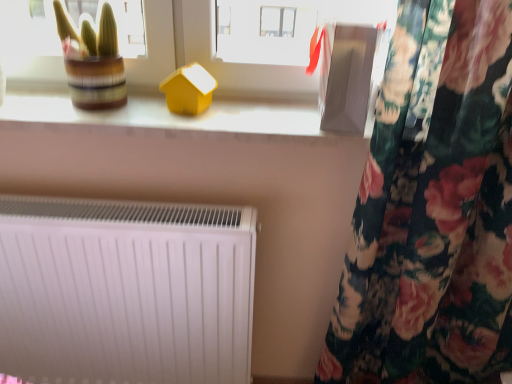
Find the location of a particular element. This screenshot has width=512, height=384. matte yellow house at upper center is located at coordinates (168, 114).

Measure the distance between white matte radiator at lower left and camera.

A distance of 98.73 centimeters exists between white matte radiator at lower left and camera.

Image resolution: width=512 pixels, height=384 pixels. What do you see at coordinates (92, 60) in the screenshot?
I see `green striped pot at upper left` at bounding box center [92, 60].

Measure the distance between point (105, 15) and camera.

The depth of point (105, 15) is 3.37 feet.

What is the approximate width of white plastic house at upper center?

2.59 inches.

The width and height of the screenshot is (512, 384). What are the coordinates of `matte yellow house at center` in the screenshot? It's located at (188, 90).

At what (x,y) coordinates should I click in order to perform the action: click on window above the matte yellow house at upper center (from the image's perspective). Please return your answer as a coordinate pair (x, y). This screenshot has width=512, height=384. Looking at the image, I should click on (254, 52).

Is white plastic house at upper center facing towards matte yellow house at upper center?

No, white plastic house at upper center does not turn towards matte yellow house at upper center.

Who is smaller, white plastic house at upper center or matte yellow house at upper center?

With smaller size is matte yellow house at upper center.

Which is more to the right, white plastic house at upper center or matte yellow house at upper center?

white plastic house at upper center.

Which object is wider, matte yellow house at upper center or green striped pot at upper left?

matte yellow house at upper center.

Is the position of matte yellow house at upper center less distant than that of green striped pot at upper left?

That is False.

From a real-world perspective, is matte yellow house at upper center over green striped pot at upper left?

No, from a real-world perspective, matte yellow house at upper center is not on top of green striped pot at upper left.

Does matte yellow house at upper center contain green striped pot at upper left?

Definitely not — green striped pot at upper left is not inside matte yellow house at upper center.

Does green striped pot at upper left have a lesser width compared to matte yellow house at center?

Incorrect, the width of green striped pot at upper left is not less than that of matte yellow house at center.

Is green striped pot at upper left next to matte yellow house at center?

No, green striped pot at upper left is not in contact with matte yellow house at center.

Based on the photo, measure the distance from green striped pot at upper left to matte yellow house at center.

The distance of green striped pot at upper left from matte yellow house at center is 18.67 centimeters.

Looking at their sizes, would you say white matte radiator at lower left is wider or thinner than green striped pot at upper left?

Considering their sizes, white matte radiator at lower left looks slimmer than green striped pot at upper left.

Would you say green striped pot at upper left is part of white matte radiator at lower left's contents?

No, green striped pot at upper left is located outside of white matte radiator at lower left.

Does white matte radiator at lower left lie in front of green striped pot at upper left?

That is False.

Is point (220, 350) closer or farther from the camera than point (71, 40)?

Point (220, 350) is farther from the camera than point (71, 40).

From the image's perspective, is white plastic house at upper center above or below matte yellow house at center?

From the image's perspective, white plastic house at upper center appears above matte yellow house at center.

Is white plastic house at upper center with matte yellow house at center?

No.

Visually, is white plastic house at upper center positioned to the left or to the right of matte yellow house at center?

Based on their positions, white plastic house at upper center is located to the right of matte yellow house at center.

Is white plastic house at upper center oriented towards matte yellow house at center?

Yes.

From their relative heights in the image, would you say green striped pot at upper left is taller or shorter than matte yellow house at upper center?

Clearly, green striped pot at upper left is taller compared to matte yellow house at upper center.

From the image's perspective, is green striped pot at upper left located above or below matte yellow house at upper center?

Clearly, from the image's perspective, green striped pot at upper left is above matte yellow house at upper center.

Considering the sizes of green striped pot at upper left and matte yellow house at upper center in the image, is green striped pot at upper left wider or thinner than matte yellow house at upper center?

In the image, green striped pot at upper left appears to be more narrow than matte yellow house at upper center.

Is green striped pot at upper left facing towards matte yellow house at upper center?

No, green striped pot at upper left does not turn towards matte yellow house at upper center.

Would you say white matte radiator at lower left is inside or outside white plastic house at upper center?

white matte radiator at lower left exists outside the volume of white plastic house at upper center.

Is point (8, 347) positioned in front of point (27, 30)?

That is True.

Would you say white matte radiator at lower left is to the left or to the right of white plastic house at upper center in the picture?

In the image, white matte radiator at lower left appears on the left side of white plastic house at upper center.

Considering the sizes of objects white matte radiator at lower left and white plastic house at upper center in the image provided, who is shorter, white matte radiator at lower left or white plastic house at upper center?

white plastic house at upper center.

Find the location of a particular element. Image resolution: width=512 pixels, height=384 pixels. window that appears above the matte yellow house at upper center (from a real-world perspective) is located at coordinates pos(254,52).

The width and height of the screenshot is (512, 384). In the image, there is a green striped pot at upper left. Identify the location of window sill below it (from the image's perspective). (168, 114).

Considering their positions, is matte yellow house at center positioned further to white matte radiator at lower left than white plastic house at upper center?

matte yellow house at center.

Estimate the real-world distances between objects in this image. Which object is further from matte yellow house at center, green striped pot at upper left or white matte radiator at lower left?

Based on the image, white matte radiator at lower left appears to be further to matte yellow house at center.

Considering their positions, is white matte radiator at lower left positioned closer to matte yellow house at center than green striped pot at upper left?

green striped pot at upper left is closer to matte yellow house at center.

Which object lies nearer to the anchor point white matte radiator at lower left, green striped pot at upper left or matte yellow house at upper center?

matte yellow house at upper center is positioned closer to the anchor white matte radiator at lower left.

Estimate the real-world distances between objects in this image. Which object is further from matte yellow house at center, matte yellow house at upper center or white plastic house at upper center?

Based on the image, white plastic house at upper center appears to be further to matte yellow house at center.

Looking at the image, which one is located further to green striped pot at upper left, matte yellow house at upper center or white matte radiator at lower left?

white matte radiator at lower left is positioned further to the anchor green striped pot at upper left.

From the image, which object appears to be nearer to matte yellow house at upper center, matte yellow house at center or white matte radiator at lower left?

The object closer to matte yellow house at upper center is matte yellow house at center.

When comparing their distances from green striped pot at upper left, does matte yellow house at center or matte yellow house at upper center seem closer?

Based on the image, matte yellow house at upper center appears to be nearer to green striped pot at upper left.

Image resolution: width=512 pixels, height=384 pixels. Find the location of `window sill between green striped pot at upper left and white plastic house at upper center from left to right`. window sill between green striped pot at upper left and white plastic house at upper center from left to right is located at coordinates (168, 114).

Identify the location of toy situated between green striped pot at upper left and matte yellow house at upper center from left to right. (188, 90).

Locate an element on the screen. The height and width of the screenshot is (384, 512). window sill between matte yellow house at center and white matte radiator at lower left in the vertical direction is located at coordinates [x=168, y=114].

The width and height of the screenshot is (512, 384). In order to click on toy between white plastic house at upper center and matte yellow house at upper center in the up-down direction in this screenshot , I will do pyautogui.click(x=188, y=90).